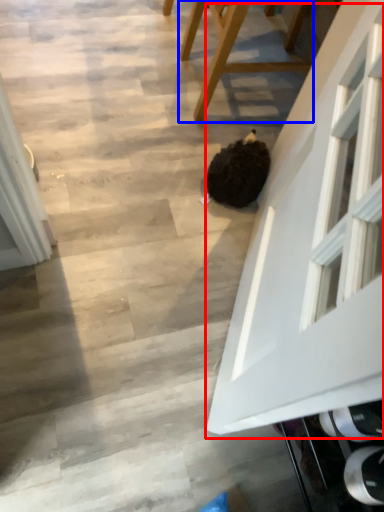
Question: Which object appears closest to the camera in this image, glass door (highlighted by a red box) or furniture (highlighted by a blue box)?

Choices:
 (A) glass door
 (B) furniture

Answer: (A)